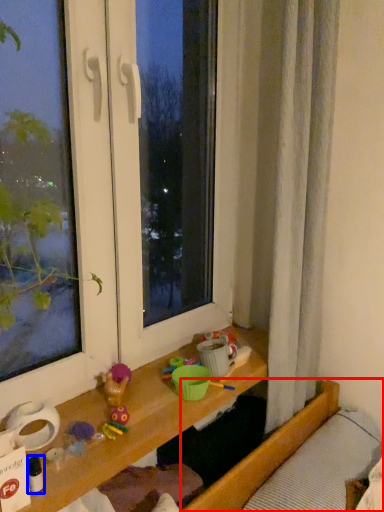
Question: Which object is closer to the camera taking this photo, bed (highlighted by a red box) or toy (highlighted by a blue box)?

Choices:
 (A) bed
 (B) toy

Answer: (B)